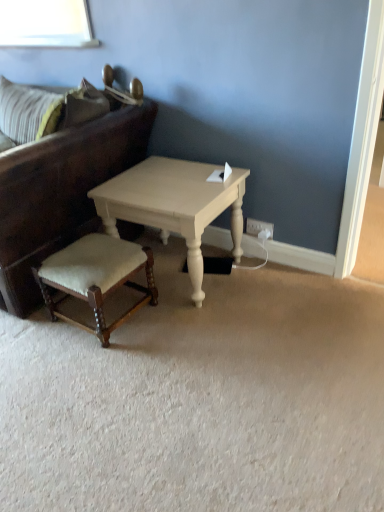
I want to click on free space in front of white painted wood coffee table at center, so 188,339.